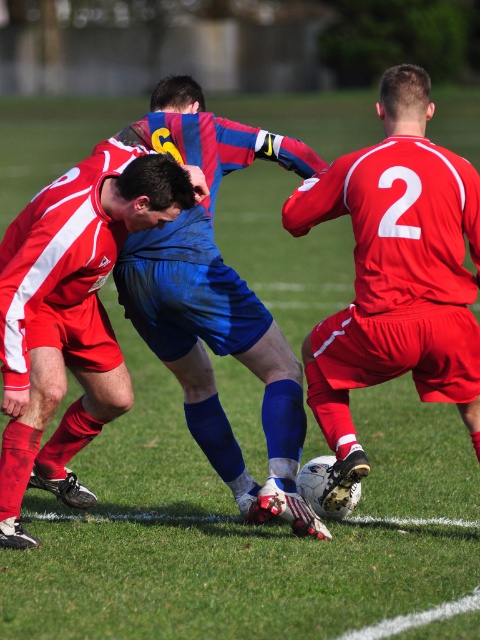
Question: Which object appears closest to the camera in this image?

Choices:
 (A) matte red jersey at center
 (B) blue fabric shorts at center

Answer: (A)

Question: Considering the real-world distances, which object is farthest from the blue fabric shorts at center?

Choices:
 (A) blue fabric shirt at center
 (B) matte red jersey at center

Answer: (B)

Question: Is matte red jersey at center smaller than blue fabric shirt at center?

Choices:
 (A) yes
 (B) no

Answer: (A)

Question: Estimate the real-world distances between objects in this image. Which object is closer to the blue fabric shirt at center?

Choices:
 (A) blue fabric shorts at center
 (B) matte red jersey at center

Answer: (A)

Question: Is matte red jersey at center to the right of blue fabric shirt at center from the viewer's perspective?

Choices:
 (A) no
 (B) yes

Answer: (B)

Question: Can you confirm if blue fabric shirt at center is positioned below blue fabric shorts at center?

Choices:
 (A) yes
 (B) no

Answer: (A)